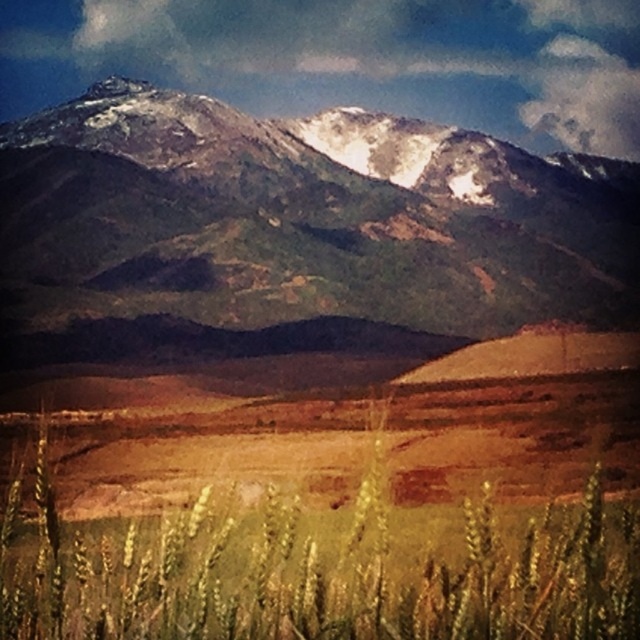
Question: Which object appears farthest from the camera in this image?

Choices:
 (A) golden matte wheat field at lower center
 (B) snowy rocky mountain range at upper center

Answer: (B)

Question: Does snowy rocky mountain range at upper center have a larger size compared to golden matte wheat field at lower center?

Choices:
 (A) yes
 (B) no

Answer: (A)

Question: Which point is farther to the camera?

Choices:
 (A) (524, 156)
 (B) (240, 600)

Answer: (A)

Question: Is snowy rocky mountain range at upper center further to camera compared to golden matte wheat field at lower center?

Choices:
 (A) no
 (B) yes

Answer: (B)

Question: Can you confirm if snowy rocky mountain range at upper center is positioned to the right of golden matte wheat field at lower center?

Choices:
 (A) no
 (B) yes

Answer: (A)

Question: Which object appears farthest from the camera in this image?

Choices:
 (A) snowy rocky mountain range at upper center
 (B) golden matte wheat field at lower center

Answer: (A)